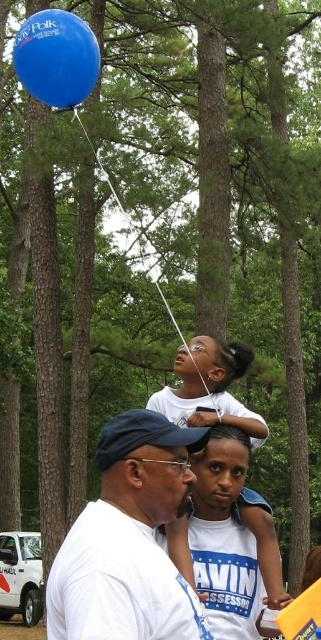
You are a photographer standing in the wooded area and want to take a photo of the blue cotton shirt at center and the blue rubber balloon at upper center. Which object should you focus on first to ensure both are in sharp focus?

You should focus on the blue cotton shirt at center first because it is closer to the viewer than the blue rubber balloon at upper center. By focusing on the closer object, the balloon will still be within the depth of field and in focus.

Where is the white matte shirt at center located in the image?

The white matte shirt at center is located at point (129,540) in the image.